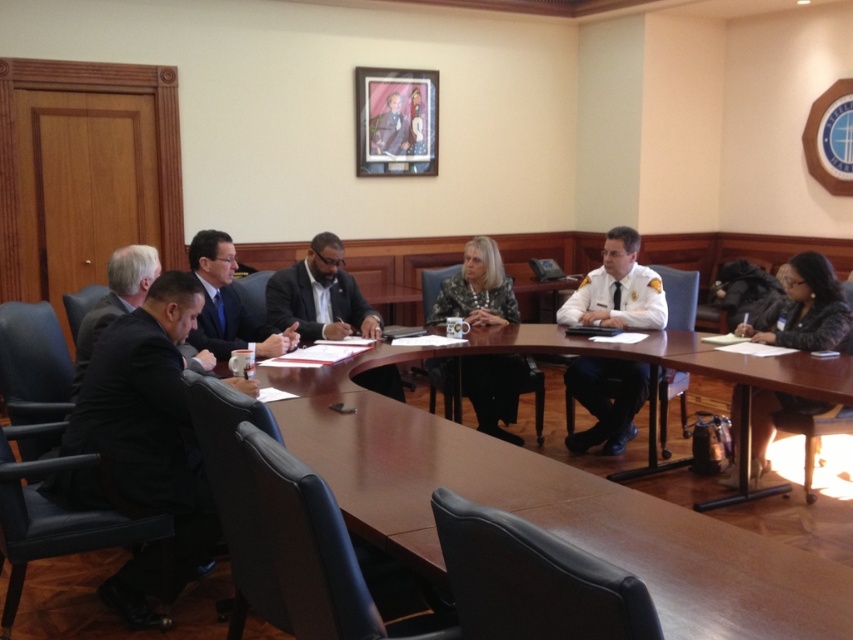
You are a guest entering the conference room and need to locate the person in the white uniform at center and the individual wearing the black fur coat at lower right. Which of these two individuals is standing closer to the conference table?

The white uniform at center is taller than black fur coat at lower right, so the person in the white uniform at center is likely standing closer to the conference table since taller individuals often occupy central positions during meetings.

You are a guest entering the conference room and need to reach the door at the back of the room. There is a white uniform at center and a black fur coat at lower right in your way. Which object should you move around to reach the door?

You should move around the black fur coat at lower right because the white uniform at center is closer to you and blocking your path, while the black fur coat at lower right is further away and not directly in your path to the door.

Based on the photo, you are sitting at the conference table in the meeting. You need to pass a document to the person at point (798,388). Is this person sitting in front of or behind the person at point (483,260)?

The person at point (798,388) is in front of the person at point (483,260).